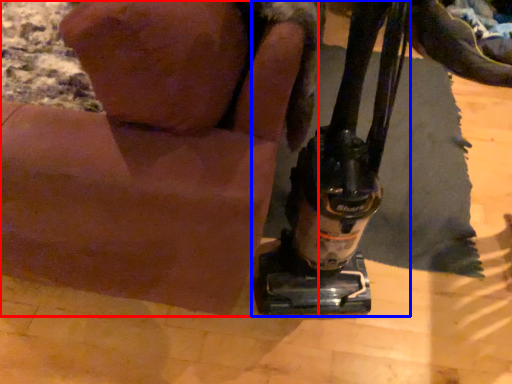
Question: Which of the following is the closest to the observer, animal (highlighted by a red box) or sewing machine (highlighted by a blue box)?

Choices:
 (A) animal
 (B) sewing machine

Answer: (A)